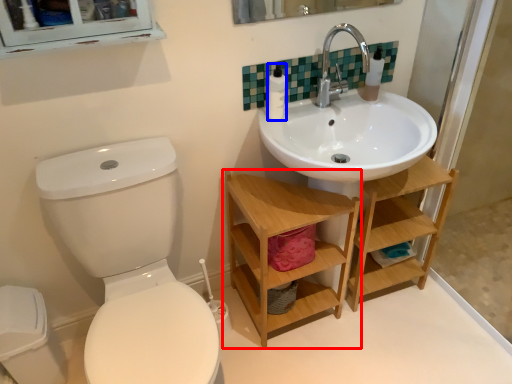
Question: Which of the following is the farthest to the observer, shelf (highlighted by a red box) or toiletry (highlighted by a blue box)?

Choices:
 (A) shelf
 (B) toiletry

Answer: (B)